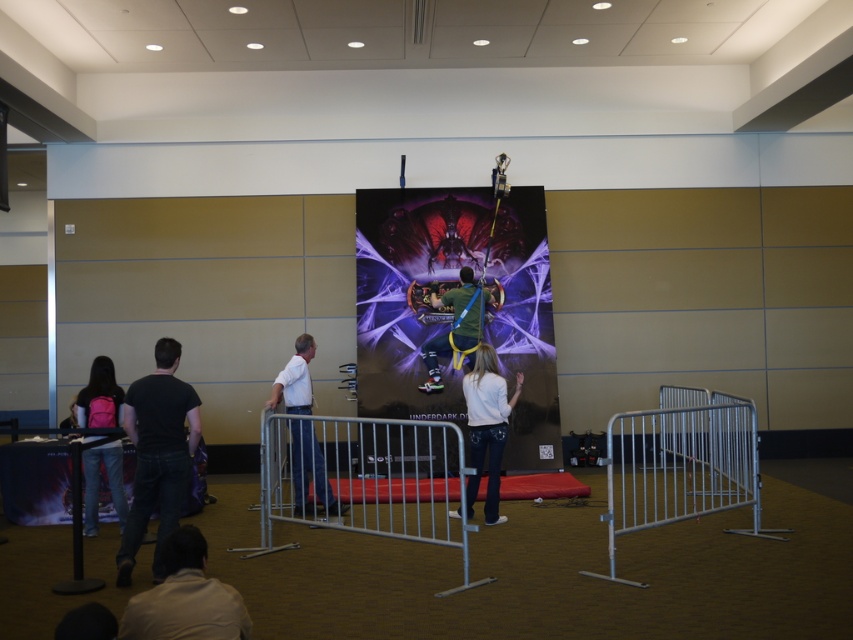
Which is more to the right, white denim jeans at center or green fabric shirt at center?

Positioned to the right is white denim jeans at center.

Can you confirm if white denim jeans at center is smaller than green fabric shirt at center?

Incorrect, white denim jeans at center is not smaller in size than green fabric shirt at center.

This screenshot has width=853, height=640. Identify the location of white denim jeans at center. (486, 426).

Where is `white denim jeans at center`? The image size is (853, 640). white denim jeans at center is located at coordinates (486, 426).

Is white shirt at lower left smaller than white denim jeans at center?

Yes, white shirt at lower left is smaller than white denim jeans at center.

Who is positioned more to the right, white shirt at lower left or white denim jeans at center?

white denim jeans at center

Between point (178, 541) and point (492, 419), which one is positioned behind?

The point (492, 419) is more distant.

Where is `white shirt at lower left`? white shirt at lower left is located at coordinates (184, 596).

Consider the image. Which is more to the left, silver metallic barrier at lower right or white matte shirt at center?

white matte shirt at center

Does point (722, 454) come farther from viewer compared to point (291, 413)?

Yes, point (722, 454) is behind point (291, 413).

The width and height of the screenshot is (853, 640). In order to click on silver metallic barrier at lower right in this screenshot , I will do `click(680, 465)`.